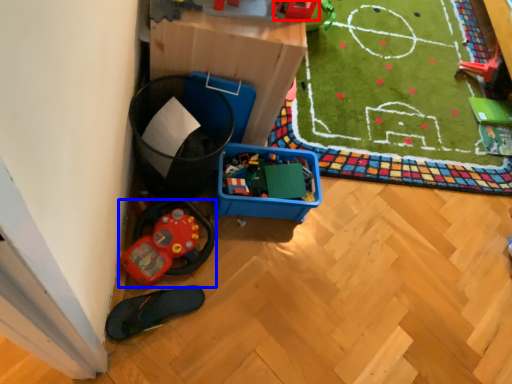
Question: Which point is further to the camera, toy (highlighted by a red box) or toy (highlighted by a blue box)?

Choices:
 (A) toy
 (B) toy

Answer: (B)